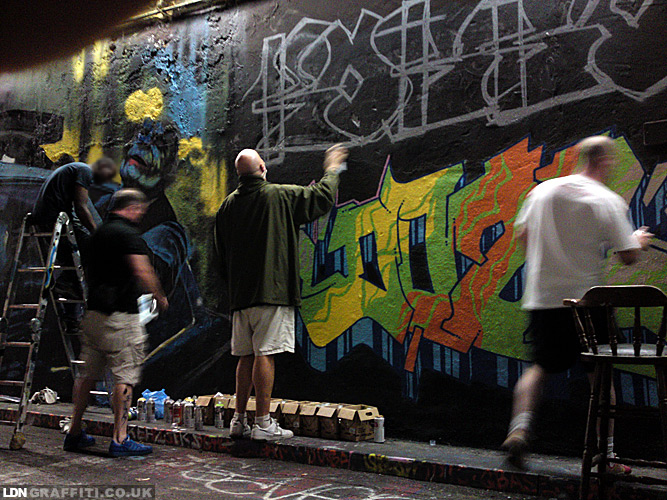
Where is `paint cans`? The height and width of the screenshot is (500, 667). paint cans is located at coordinates (195, 422), (187, 416), (179, 410), (167, 410), (153, 411), (141, 410).